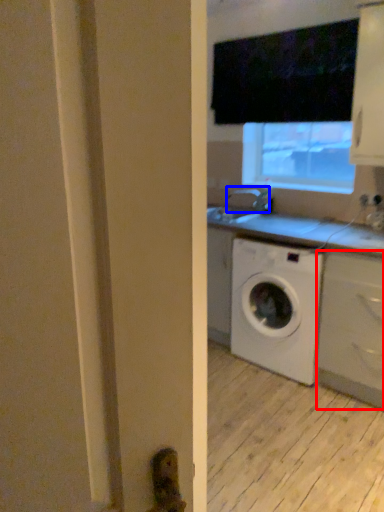
Question: Which object is closer to the camera taking this photo, cabinetry (highlighted by a red box) or faucet (highlighted by a blue box)?

Choices:
 (A) cabinetry
 (B) faucet

Answer: (A)